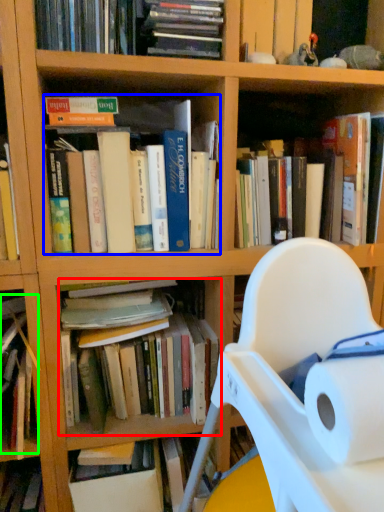
Question: Which is nearer to the book (highlighted by a red box)? book (highlighted by a blue box) or book (highlighted by a green box).

Choices:
 (A) book
 (B) book

Answer: (B)